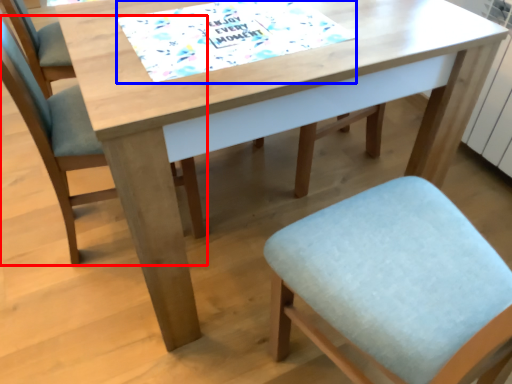
Question: Which of the following is the farthest to the observer, chair (highlighted by a red box) or place mat (highlighted by a blue box)?

Choices:
 (A) chair
 (B) place mat

Answer: (A)